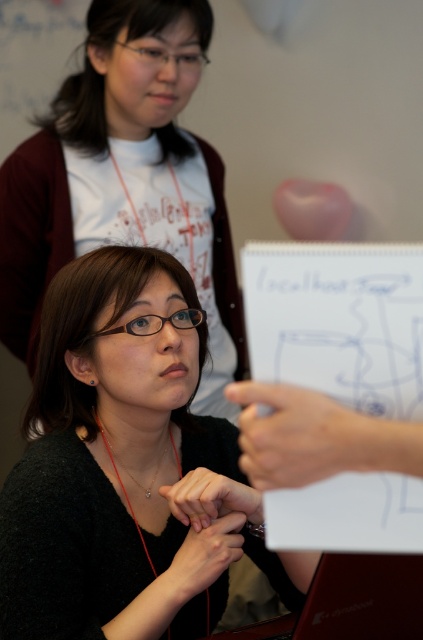
Question: Which object is the closest to the black matte sweater at center?

Choices:
 (A) gold chain necklace at center
 (B) matte black shirt at center

Answer: (A)

Question: Is matte black shirt at center to the right of gold chain necklace at center from the viewer's perspective?

Choices:
 (A) yes
 (B) no

Answer: (B)

Question: Is the position of black matte sweater at center more distant than that of gold chain necklace at center?

Choices:
 (A) yes
 (B) no

Answer: (B)

Question: Which point is farther from the camera taking this photo?

Choices:
 (A) (112, 68)
 (B) (172, 433)

Answer: (A)

Question: Which point appears farthest from the camera in this image?

Choices:
 (A) (206, 17)
 (B) (224, 509)
 (C) (159, 465)

Answer: (A)

Question: Is matte black shirt at center bigger than gold chain necklace at center?

Choices:
 (A) yes
 (B) no

Answer: (A)